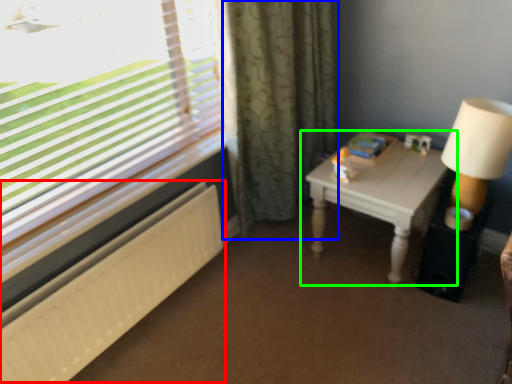
Question: Which object is the closest to the radiator (highlighted by a red box)? Choose among these: curtain (highlighted by a blue box) or table (highlighted by a green box).

Choices:
 (A) curtain
 (B) table

Answer: (A)